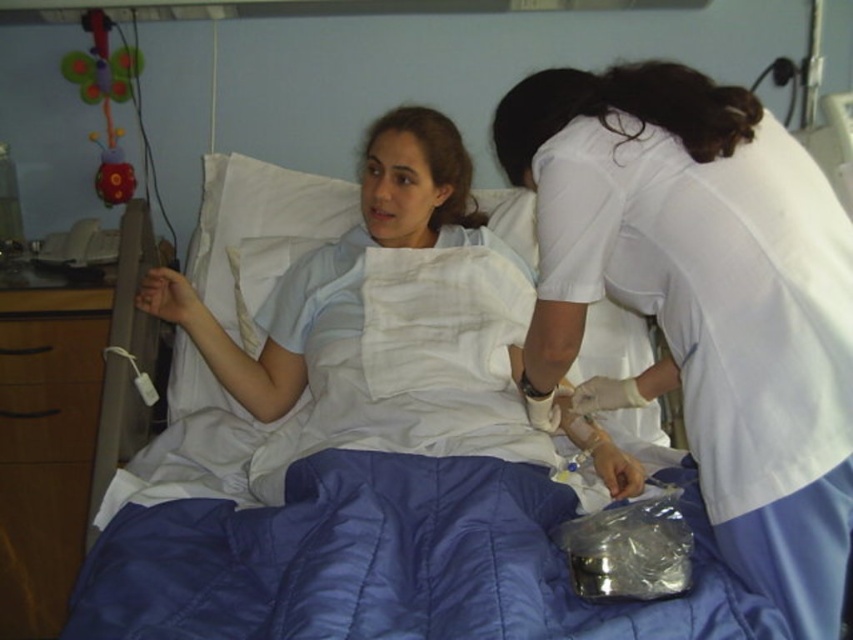
Is blue quilted bed at center bigger than white smooth uniform at center?

Correct, blue quilted bed at center is larger in size than white smooth uniform at center.

Can you confirm if blue quilted bed at center is taller than white smooth uniform at center?

No.

Identify the location of blue quilted bed at center. (374, 483).

The width and height of the screenshot is (853, 640). What are the coordinates of `blue quilted bed at center` in the screenshot? It's located at (374, 483).

Between blue quilted bed at center and wooden drawer at lower left, which one is positioned lower?

wooden drawer at lower left

Is point (413, 436) closer to camera compared to point (84, 424)?

Yes, it is.

Is point (421, 332) farther from camera compared to point (44, 417)?

That is False.

At what (x,y) coordinates should I click in order to perform the action: click on blue quilted bed at center. Please return your answer as a coordinate pair (x, y). Looking at the image, I should click on (374, 483).

Which is behind, point (55, 410) or point (108, 253)?

Point (108, 253)

I want to click on wooden drawer at lower left, so click(48, 420).